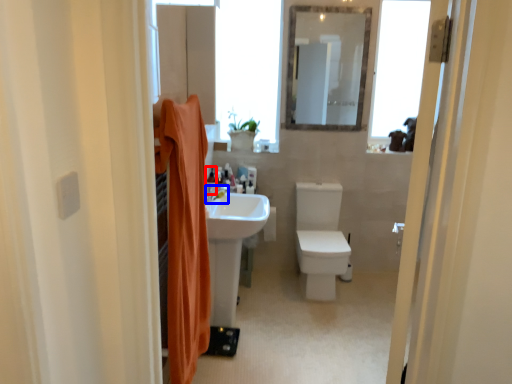
Question: Among these objects, which one is farthest to the camera, toiletry (highlighted by a red box) or tap (highlighted by a blue box)?

Choices:
 (A) toiletry
 (B) tap

Answer: (A)